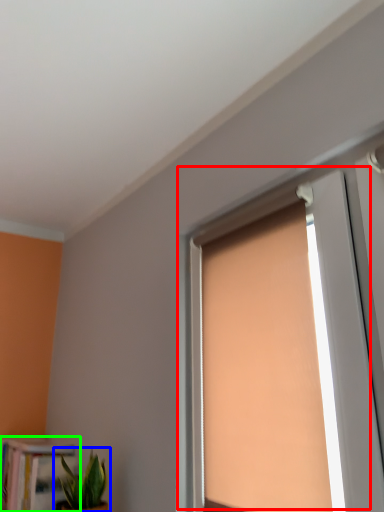
Question: Which is nearer to the window (highlighted by a red box)? houseplant (highlighted by a blue box) or bookcase (highlighted by a green box).

Choices:
 (A) houseplant
 (B) bookcase

Answer: (A)